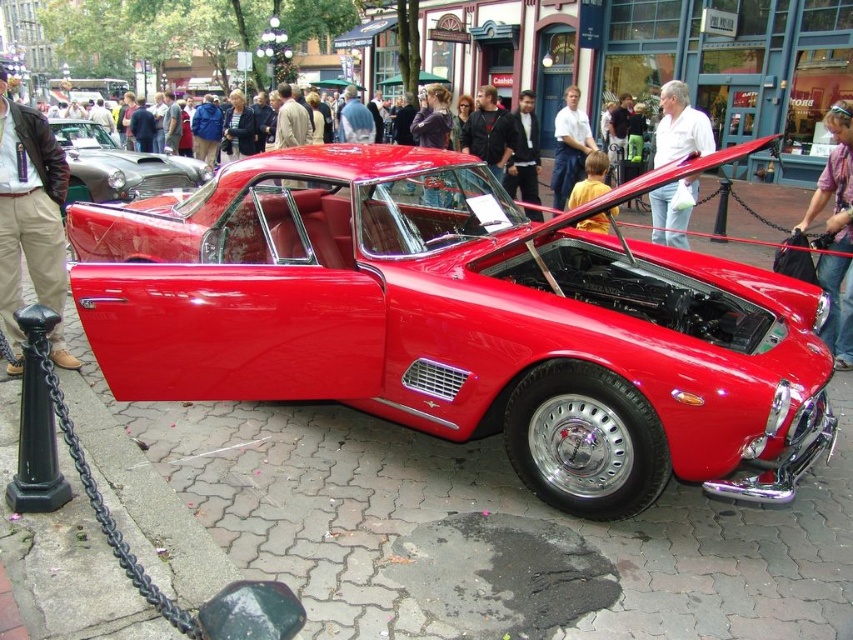
Who is positioned more to the right, shiny red car at center or shiny metallic car at left?

Positioned to the right is shiny red car at center.

Does shiny red car at center have a greater width compared to shiny metallic car at left?

Yes.

Identify the location of shiny red car at center. pos(459,323).

Does khaki cotton pants at left appear on the right side of shiny metallic car at left?

Correct, you'll find khaki cotton pants at left to the right of shiny metallic car at left.

Who is higher up, khaki cotton pants at left or shiny metallic car at left?

shiny metallic car at left is above.

Is point (44, 227) more distant than point (50, 122)?

No, (44, 227) is closer to viewer.

Locate an element on the screen. The image size is (853, 640). khaki cotton pants at left is located at coordinates (28, 209).

Who is more distant from viewer, (347,356) or (44,280)?

Positioned behind is point (44,280).

Locate an element on the screen. shiny red car at center is located at coordinates (459, 323).